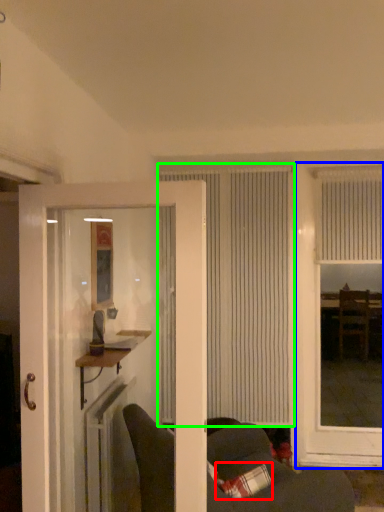
Question: Which object is positioned farthest from pillow (highlighted by a red box)? Select from window (highlighted by a blue box) and window (highlighted by a green box).

Choices:
 (A) window
 (B) window

Answer: (A)